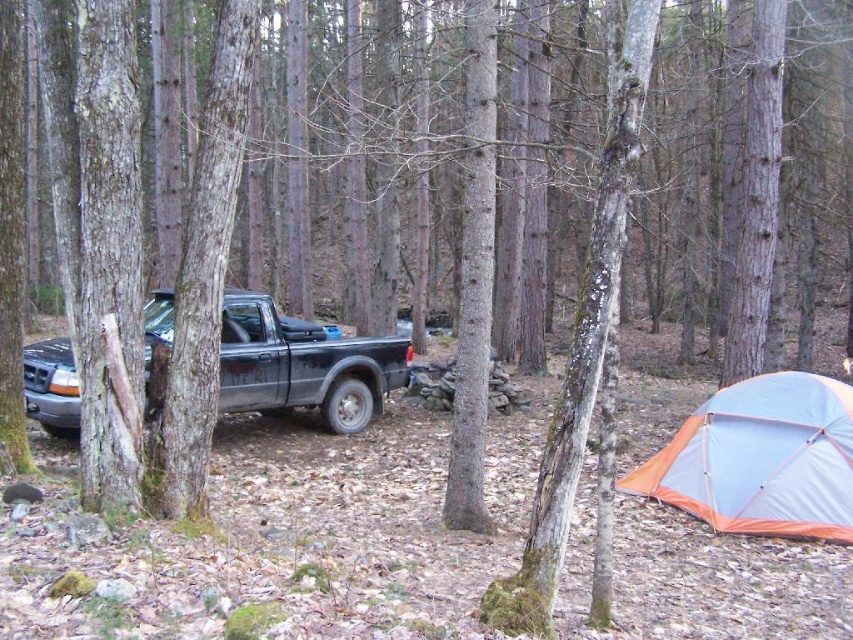
Is the position of orange fabric tent at lower right more distant than that of matte black truck at left?

No.

Who is more distant from viewer, (x=795, y=380) or (x=256, y=314)?

The point (x=256, y=314) is more distant.

The width and height of the screenshot is (853, 640). Identify the location of orange fabric tent at lower right. (761, 458).